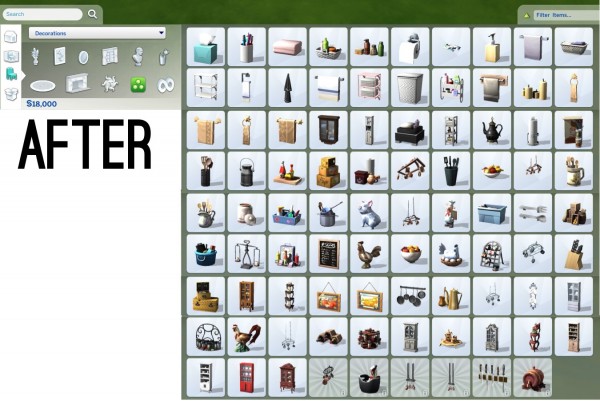
The image size is (600, 401). Find the location of `kitchen cabinet hutches`. kitchen cabinet hutches is located at coordinates (250, 294), (205, 375), (246, 378), (284, 376), (408, 344), (481, 339), (568, 299), (571, 339).